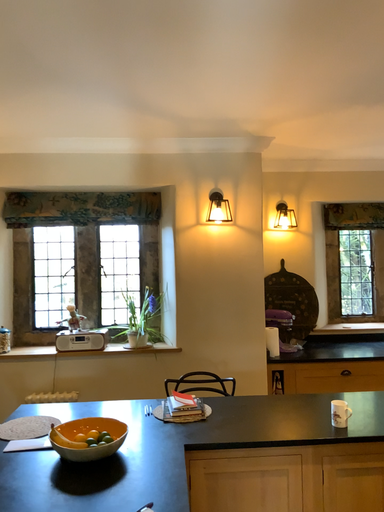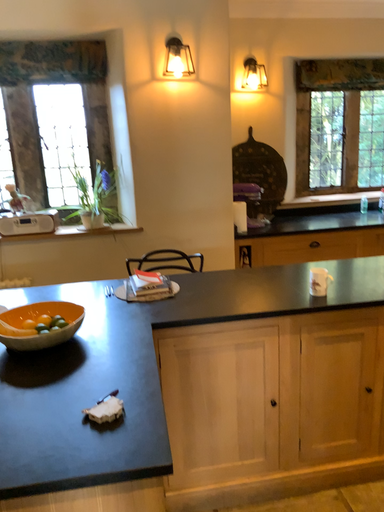
Question: Which way did the camera rotate in the video?

Choices:
 (A) rotated downward
 (B) rotated upward

Answer: (A)